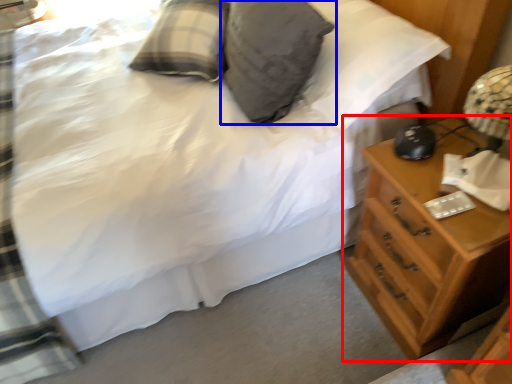
Question: Which of the following is the closest to the observer, chest of drawers (highlighted by a red box) or pillow (highlighted by a blue box)?

Choices:
 (A) chest of drawers
 (B) pillow

Answer: (A)